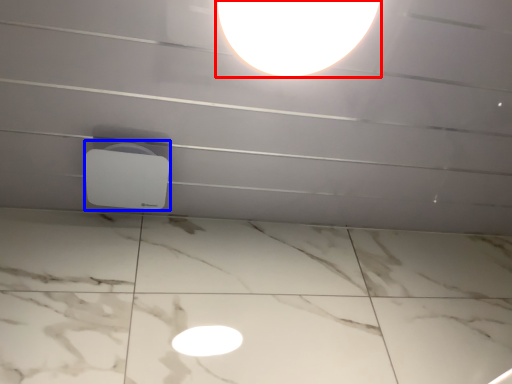
Question: Which point is closer to the camera, lamp (highlighted by a red box) or lamp (highlighted by a blue box)?

Choices:
 (A) lamp
 (B) lamp

Answer: (A)